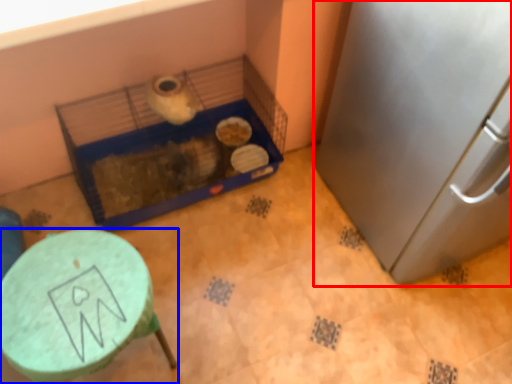
Question: Which point is closer to the camera, appliance (highlighted by a red box) or furniture (highlighted by a blue box)?

Choices:
 (A) appliance
 (B) furniture

Answer: (A)